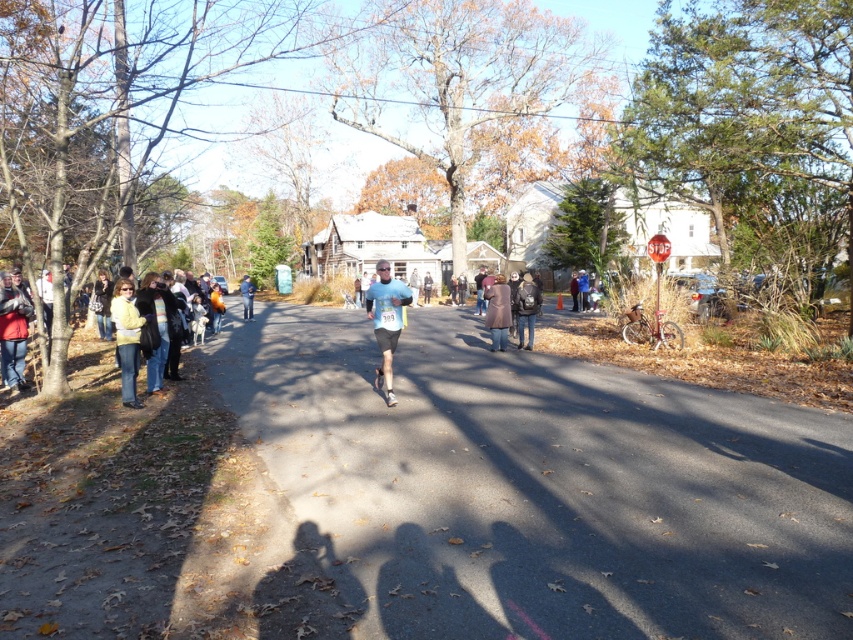
Measure the distance from light blue fabric shirt at center to brown wool coat at center.

light blue fabric shirt at center is 5.65 meters away from brown wool coat at center.

Who is shorter, light blue fabric shirt at center or brown wool coat at center?

light blue fabric shirt at center

At what (x,y) coordinates should I click in order to perform the action: click on light blue fabric shirt at center. Please return your answer as a coordinate pair (x, y). The width and height of the screenshot is (853, 640). Looking at the image, I should click on (386, 321).

Between point (135, 365) and point (527, 288), which one is positioned in front?

Point (135, 365) is in front.

Locate an element on the screen. yellow fleece jacket at left is located at coordinates (126, 339).

Locate an element on the screen. This screenshot has height=640, width=853. yellow fleece jacket at left is located at coordinates (126, 339).

This screenshot has width=853, height=640. Find the location of `yellow fleece jacket at left`. yellow fleece jacket at left is located at coordinates (126, 339).

How far apart are leather jacket at center and blue fabric jacket at center?

leather jacket at center is 14.26 meters away from blue fabric jacket at center.

Consider the image. Does leather jacket at center appear on the left side of blue fabric jacket at center?

Incorrect, leather jacket at center is not on the left side of blue fabric jacket at center.

Does point (526, 321) come behind point (242, 282)?

No, it is not.

Find the location of a particular element. This screenshot has width=853, height=640. leather jacket at center is located at coordinates (526, 308).